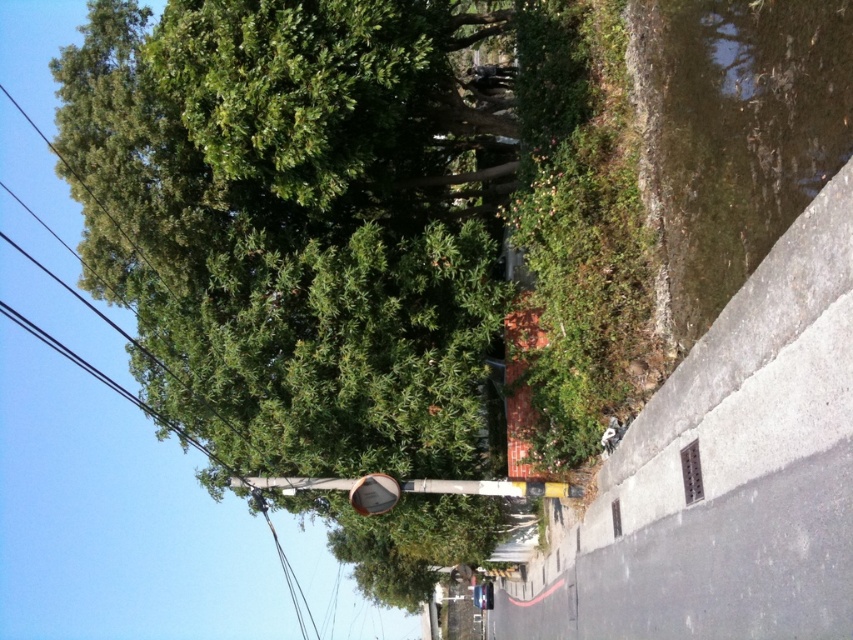
Question: Does green leafy tree at upper left appear on the right side of metallic pole at center?

Choices:
 (A) yes
 (B) no

Answer: (B)

Question: Which point appears closest to the camera in this image?

Choices:
 (A) (250, 486)
 (B) (477, 524)

Answer: (A)

Question: Which object appears farthest from the camera in this image?

Choices:
 (A) metallic pole at center
 (B) green leafy tree at upper left

Answer: (A)

Question: Is green leafy tree at upper left smaller than metallic pole at center?

Choices:
 (A) no
 (B) yes

Answer: (A)

Question: Is green leafy tree at upper left to the left of metallic pole at center from the viewer's perspective?

Choices:
 (A) no
 (B) yes

Answer: (B)